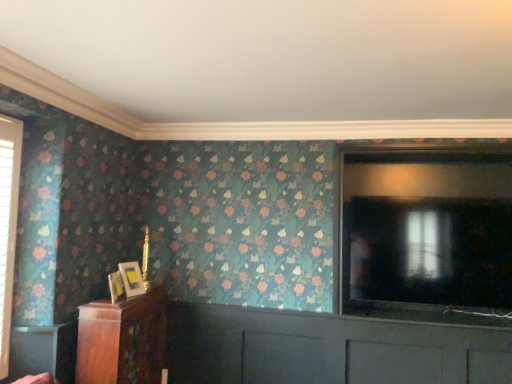
Question: Are wooden table at lower left and wooden cabinet at lower left far apart?

Choices:
 (A) yes
 (B) no

Answer: (B)

Question: Is wooden table at lower left further to the viewer compared to wooden cabinet at lower left?

Choices:
 (A) no
 (B) yes

Answer: (A)

Question: Can you confirm if wooden table at lower left is positioned to the left of wooden cabinet at lower left?

Choices:
 (A) yes
 (B) no

Answer: (A)

Question: From the image's perspective, is wooden table at lower left over wooden cabinet at lower left?

Choices:
 (A) no
 (B) yes

Answer: (B)

Question: Can you confirm if wooden table at lower left is taller than wooden cabinet at lower left?

Choices:
 (A) no
 (B) yes

Answer: (A)

Question: Based on their sizes in the image, would you say matte gold picture frame at lower left, the first picture frame viewed from the back, is bigger or smaller than wooden table at lower left?

Choices:
 (A) small
 (B) big

Answer: (B)

Question: Is matte gold picture frame at lower left, the first picture frame viewed from the back, taller or shorter than wooden table at lower left?

Choices:
 (A) tall
 (B) short

Answer: (B)

Question: Does point (134, 284) appear closer or farther from the camera than point (58, 367)?

Choices:
 (A) farther
 (B) closer

Answer: (A)

Question: In the image, is matte gold picture frame at lower left, acting as the 2th picture frame starting from the front, on the left side or the right side of wooden table at lower left?

Choices:
 (A) right
 (B) left

Answer: (A)

Question: From their relative heights in the image, would you say white matte ceiling at upper center is taller or shorter than matte gold picture frame at lower left, the first picture frame viewed from the back?

Choices:
 (A) tall
 (B) short

Answer: (B)

Question: Is white matte ceiling at upper center to the left or to the right of matte gold picture frame at lower left, the first picture frame viewed from the back, in the image?

Choices:
 (A) left
 (B) right

Answer: (B)

Question: From the image's perspective, is white matte ceiling at upper center located above or below matte gold picture frame at lower left, the first picture frame viewed from the back?

Choices:
 (A) below
 (B) above

Answer: (B)

Question: Relative to matte gold picture frame at lower left, the first picture frame viewed from the back, is white matte ceiling at upper center in front or behind?

Choices:
 (A) behind
 (B) front

Answer: (B)

Question: Considering the positions of wooden table at lower left and white matte ceiling at upper center in the image, is wooden table at lower left taller or shorter than white matte ceiling at upper center?

Choices:
 (A) tall
 (B) short

Answer: (A)

Question: From the image's perspective, is wooden table at lower left located above or below white matte ceiling at upper center?

Choices:
 (A) above
 (B) below

Answer: (B)